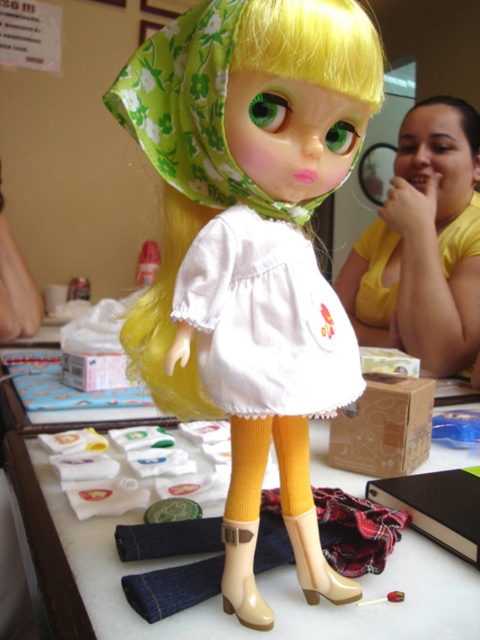
Between yellow/yellowish skin tone at upper right and dark brown shiny hair at upper right, which one has less height?

With less height is dark brown shiny hair at upper right.

Who is positioned more to the right, yellow/yellowish skin tone at upper right or dark brown shiny hair at upper right?

Positioned to the right is dark brown shiny hair at upper right.

Who is more distant from viewer, (472, 109) or (460, 109)?

The point (472, 109) is behind.

At what (x,y) coordinates should I click in order to perform the action: click on yellow/yellowish skin tone at upper right. Please return your answer as a coordinate pair (x, y). Looking at the image, I should click on (423, 244).

Is matte white dress at center shorter than white cotton dress at center?

No, matte white dress at center is not shorter than white cotton dress at center.

Between point (312, 269) and point (290, 376), which one is positioned behind?

Positioned behind is point (312, 269).

Between point (285, 244) and point (210, 294), which one is positioned in front?

Point (210, 294) is in front.

I want to click on matte white dress at center, so click(251, 241).

The height and width of the screenshot is (640, 480). Describe the element at coordinates (88, 563) in the screenshot. I see `white fabric at center` at that location.

Is white fabric at center to the left of white cotton dress at center from the viewer's perspective?

In fact, white fabric at center is to the right of white cotton dress at center.

Find the location of a particular element. This screenshot has height=640, width=480. white fabric at center is located at coordinates (88, 563).

You are a GUI agent. You are given a task and a screenshot of the screen. Output one action in this format:
    pyautogui.click(x=<x>, y=<y>)
    Task: Click on the white fabric at center
    Image resolution: width=480 pixels, height=640 pixels.
    Given the screenshot: What is the action you would take?
    pyautogui.click(x=88, y=563)